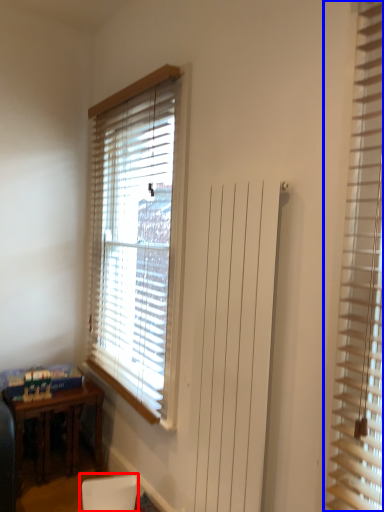
Question: Among these objects, which one is nearest to the camera, armchair (highlighted by a red box) or window blind (highlighted by a blue box)?

Choices:
 (A) armchair
 (B) window blind

Answer: (B)